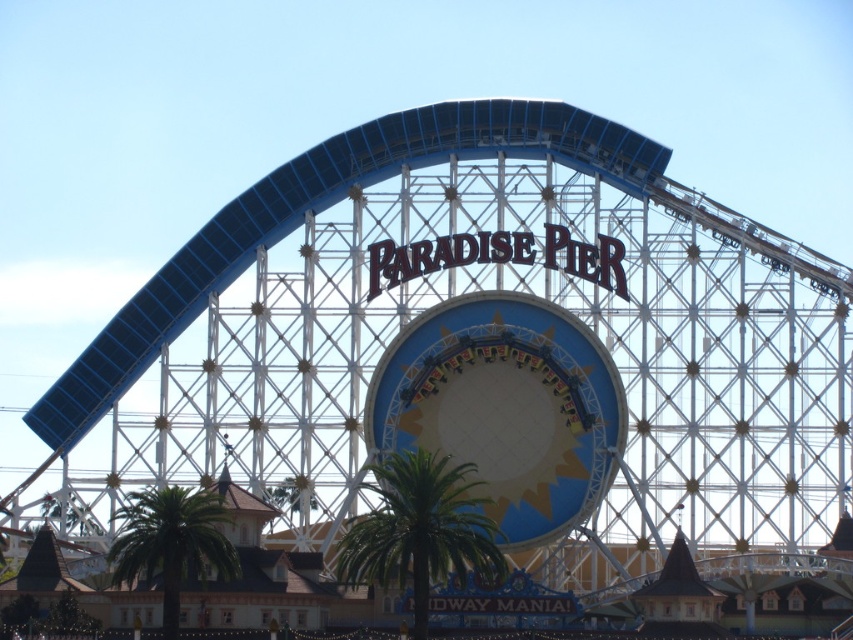
Question: Can you confirm if green leafy palm tree at center is positioned above green leafy palm tree at lower left?

Choices:
 (A) yes
 (B) no

Answer: (A)

Question: Can you confirm if matte blue and white amusement ride at center is positioned below green leafy palm tree at center?

Choices:
 (A) no
 (B) yes

Answer: (A)

Question: Can you confirm if matte blue and white amusement ride at center is thinner than green leafy palm tree at center?

Choices:
 (A) no
 (B) yes

Answer: (A)

Question: Which object is the closest to the green leafy palm tree at center?

Choices:
 (A) green leafy palm tree at lower left
 (B) matte blue and white amusement ride at center

Answer: (B)

Question: Which of the following is the farthest from the observer?

Choices:
 (A) green leafy palm tree at center
 (B) green leafy palm tree at lower left

Answer: (B)

Question: Which is farther from the green leafy palm tree at center?

Choices:
 (A) green leafy palm tree at lower left
 (B) matte blue and white amusement ride at center

Answer: (A)